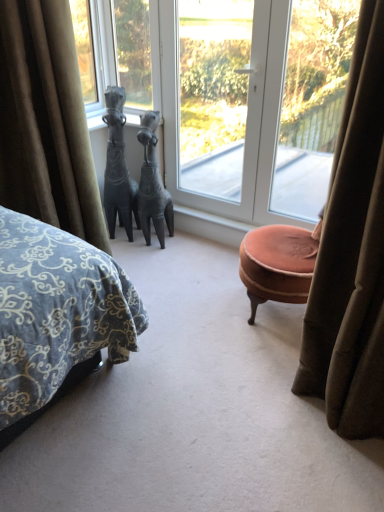
Question: From the image's perspective, is transparent glass door at center, the second window positioned from the right, over velvet brown curtain at left?

Choices:
 (A) yes
 (B) no

Answer: (A)

Question: Does transparent glass door at center, the second window positioned from the right, have a greater width compared to velvet brown curtain at left?

Choices:
 (A) no
 (B) yes

Answer: (A)

Question: Is transparent glass door at center, marked as the 2th window in a left-to-right arrangement, turned away from velvet brown curtain at left?

Choices:
 (A) no
 (B) yes

Answer: (A)

Question: Would you say transparent glass door at center, marked as the 2th window in a left-to-right arrangement, is outside velvet brown curtain at left?

Choices:
 (A) yes
 (B) no

Answer: (A)

Question: Considering the relative sizes of transparent glass door at center, marked as the 2th window in a left-to-right arrangement, and velvet brown curtain at left in the image provided, is transparent glass door at center, marked as the 2th window in a left-to-right arrangement, smaller than velvet brown curtain at left?

Choices:
 (A) yes
 (B) no

Answer: (A)

Question: From a real-world perspective, relative to black stone horse at center, is transparent glass door at center vertically above or below?

Choices:
 (A) above
 (B) below

Answer: (A)

Question: In terms of size, does transparent glass door at center appear bigger or smaller than black stone horse at center?

Choices:
 (A) big
 (B) small

Answer: (A)

Question: Looking at their shapes, would you say transparent glass door at center is wider or thinner than black stone horse at center?

Choices:
 (A) thin
 (B) wide

Answer: (A)

Question: From the image's perspective, is transparent glass door at center above or below black stone horse at center?

Choices:
 (A) below
 (B) above

Answer: (B)

Question: Based on their positions, is transparent glass door at center located to the left or right of transparent glass window at upper right, marked as the 1th window in a right-to-left arrangement?

Choices:
 (A) right
 (B) left

Answer: (B)

Question: Considering their positions, is transparent glass door at center located in front of or behind transparent glass window at upper right, the 3th window positioned from the left?

Choices:
 (A) behind
 (B) front

Answer: (A)

Question: Considering the positions of point (249, 52) and point (279, 193), is point (249, 52) closer or farther from the camera than point (279, 193)?

Choices:
 (A) closer
 (B) farther

Answer: (A)

Question: From the image's perspective, relative to transparent glass window at upper right, the 3th window positioned from the left, is transparent glass door at center above or below?

Choices:
 (A) below
 (B) above

Answer: (B)

Question: Is transparent glass window at upper center, marked as the first window in a left-to-right arrangement, wider or thinner than black stone horse at center?

Choices:
 (A) wide
 (B) thin

Answer: (B)

Question: Would you say transparent glass window at upper center, marked as the first window in a left-to-right arrangement, is inside or outside black stone horse at center?

Choices:
 (A) outside
 (B) inside

Answer: (A)